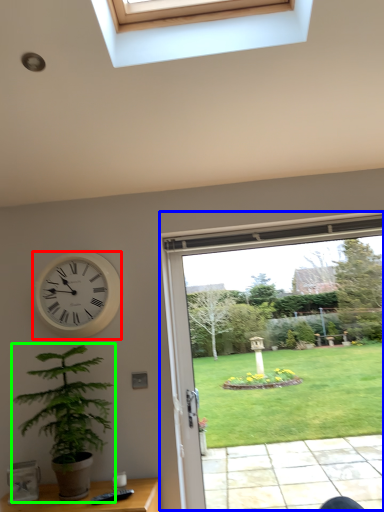
Question: Estimate the real-world distances between objects in this image. Which object is farther from wall clock (highlighted by a red box), window (highlighted by a blue box) or houseplant (highlighted by a green box)?

Choices:
 (A) window
 (B) houseplant

Answer: (A)